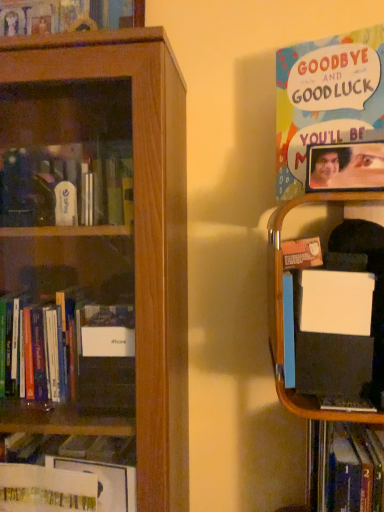
Question: Are hardcover book at lower right, the first book when ordered from bottom to top, and wooden picture frame at upper right located far from each other?

Choices:
 (A) yes
 (B) no

Answer: (B)

Question: Is hardcover book at lower right, marked as the second book in a top-to-bottom arrangement, taller than wooden picture frame at upper right?

Choices:
 (A) no
 (B) yes

Answer: (B)

Question: Is hardcover book at lower right, the first book when ordered from bottom to top, not within wooden picture frame at upper right?

Choices:
 (A) yes
 (B) no

Answer: (A)

Question: Considering the relative sizes of hardcover book at lower right, the first book when ordered from bottom to top, and wooden picture frame at upper right in the image provided, is hardcover book at lower right, the first book when ordered from bottom to top, wider than wooden picture frame at upper right?

Choices:
 (A) no
 (B) yes

Answer: (B)

Question: From the image's perspective, is hardcover book at lower right, marked as the second book in a top-to-bottom arrangement, over wooden picture frame at upper right?

Choices:
 (A) yes
 (B) no

Answer: (B)

Question: Can wooden picture frame at upper right be found inside hardcover book at lower right, marked as the second book in a top-to-bottom arrangement?

Choices:
 (A) yes
 (B) no

Answer: (B)

Question: From a real-world perspective, is multicolored paper poster at upper right, the second book when ordered from bottom to top, positioned under hardcover book at lower right, marked as the second book in a top-to-bottom arrangement, based on gravity?

Choices:
 (A) no
 (B) yes

Answer: (A)

Question: Can you confirm if multicolored paper poster at upper right, positioned as the first book in top-to-bottom order, is shorter than hardcover book at lower right, the first book when ordered from bottom to top?

Choices:
 (A) yes
 (B) no

Answer: (A)

Question: Would you say hardcover book at lower right, marked as the second book in a top-to-bottom arrangement, is part of multicolored paper poster at upper right, positioned as the first book in top-to-bottom order,'s contents?

Choices:
 (A) yes
 (B) no

Answer: (B)

Question: Considering the relative positions of multicolored paper poster at upper right, positioned as the first book in top-to-bottom order, and hardcover book at lower right, marked as the second book in a top-to-bottom arrangement, in the image provided, is multicolored paper poster at upper right, positioned as the first book in top-to-bottom order, to the left of hardcover book at lower right, marked as the second book in a top-to-bottom arrangement, from the viewer's perspective?

Choices:
 (A) yes
 (B) no

Answer: (A)

Question: Is multicolored paper poster at upper right, the second book when ordered from bottom to top, at the right side of hardcover book at lower right, the first book when ordered from bottom to top?

Choices:
 (A) no
 (B) yes

Answer: (A)

Question: From the image's perspective, would you say multicolored paper poster at upper right, the second book when ordered from bottom to top, is positioned over hardcover book at lower right, marked as the second book in a top-to-bottom arrangement?

Choices:
 (A) no
 (B) yes

Answer: (B)

Question: Considering the relative sizes of wooden picture frame at upper right and wooden bookcase at left in the image provided, is wooden picture frame at upper right bigger than wooden bookcase at left?

Choices:
 (A) yes
 (B) no

Answer: (B)